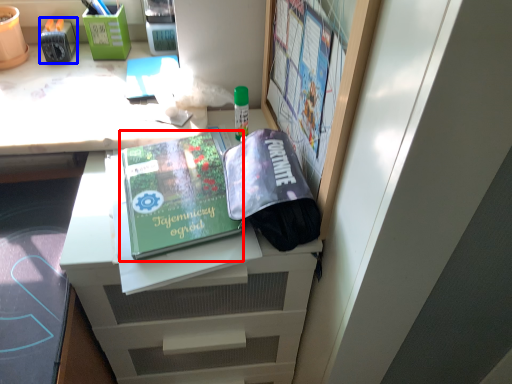
Question: Which object is closer to the camera taking this photo, paperback book (highlighted by a red box) or stationery (highlighted by a blue box)?

Choices:
 (A) paperback book
 (B) stationery

Answer: (A)